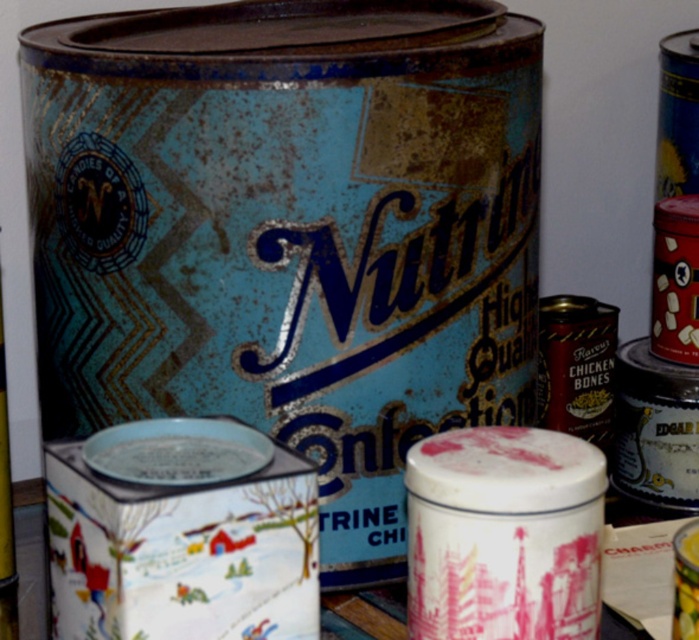
You are a collector who wants to display both the rusty metal can at center and the shiny gold can at center on a shelf. Based on their positions in the image, which can should you place closer to the front of the shelf to maintain the original arrangement?

The rusty metal can at center is in front of the shiny gold can at center, so to maintain the original arrangement, the rusty metal can at center should be placed closer to the front of the shelf.